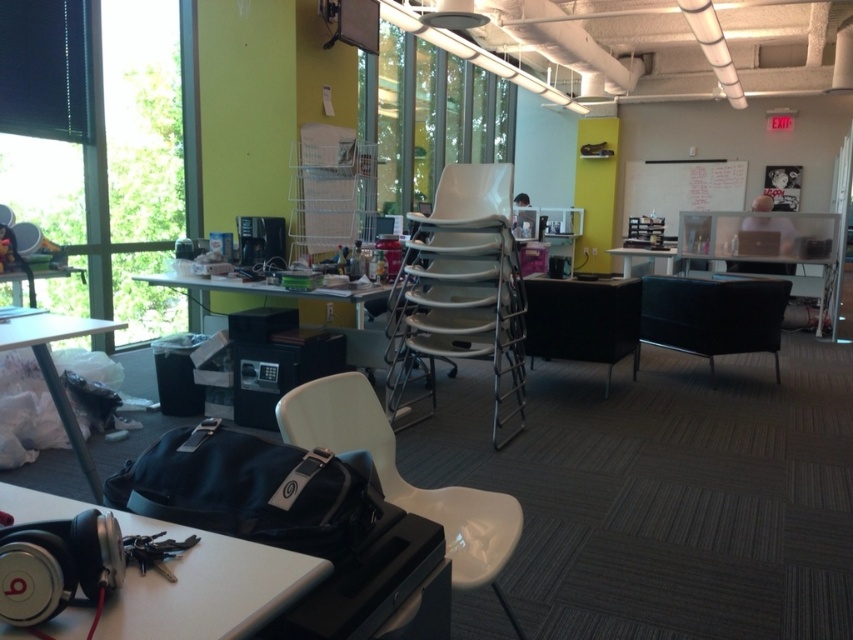
Can you confirm if black leather swivel chair at center is positioned below metallic silver table at center?

Yes, black leather swivel chair at center is below metallic silver table at center.

Does point (741, 300) come closer to viewer compared to point (320, 292)?

No, (741, 300) is further to viewer.

Between point (758, 332) and point (360, 296), which one is positioned in front?

Point (360, 296) is in front.

At what (x,y) coordinates should I click in order to perform the action: click on black leather swivel chair at center. Please return your answer as a coordinate pair (x, y). Looking at the image, I should click on (712, 316).

Who is positioned more to the left, white plastic swivel chair at center or metallic silver table at center?

metallic silver table at center

Is point (450, 496) in front of point (254, 282)?

Yes, point (450, 496) is in front of point (254, 282).

Find the location of a particular element. This screenshot has height=640, width=853. white plastic swivel chair at center is located at coordinates (403, 480).

Is transparent glass window at upper left shorter than matte black bag at lower left?

Incorrect, transparent glass window at upper left's height does not fall short of matte black bag at lower left's.

Can you confirm if transparent glass window at upper left is taller than matte black bag at lower left?

Correct, transparent glass window at upper left is much taller as matte black bag at lower left.

Describe the element at coordinates (142, 118) in the screenshot. I see `transparent glass window at upper left` at that location.

I want to click on transparent glass window at upper left, so click(x=142, y=118).